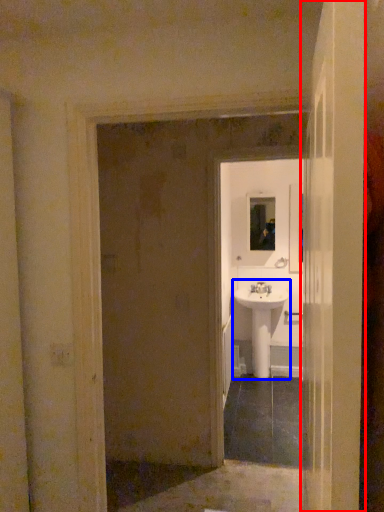
Question: Which object appears closest to the camera in this image, door (highlighted by a red box) or sink (highlighted by a blue box)?

Choices:
 (A) door
 (B) sink

Answer: (A)